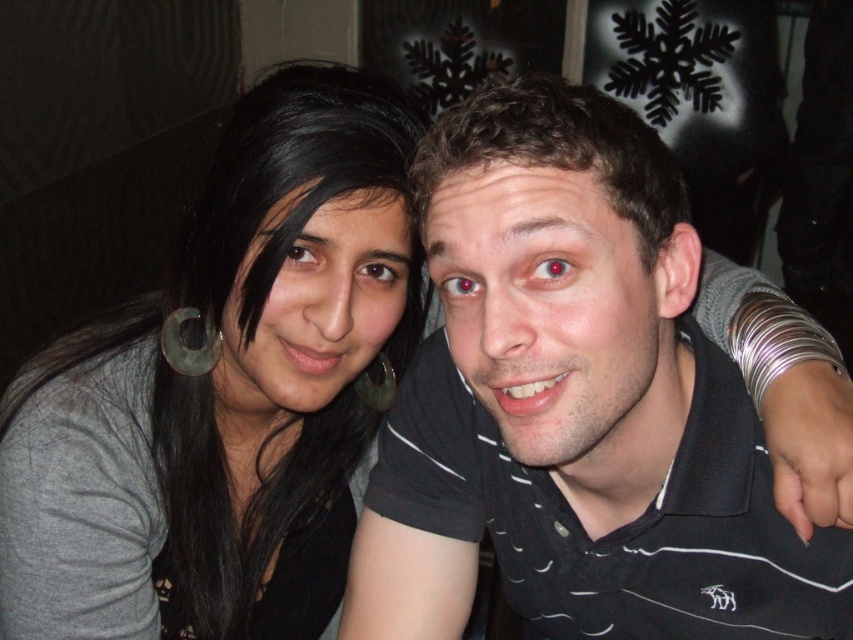
Question: Which object appears closest to the camera in this image?

Choices:
 (A) gray matte/black hair at upper left
 (B) black jersey at center

Answer: (B)

Question: Is black jersey at center wider than gray matte/black hair at upper left?

Choices:
 (A) yes
 (B) no

Answer: (A)

Question: In this image, where is black jersey at center located relative to gray matte/black hair at upper left?

Choices:
 (A) below
 (B) above

Answer: (A)

Question: Does black jersey at center appear under gray matte/black hair at upper left?

Choices:
 (A) yes
 (B) no

Answer: (A)

Question: Which point is farther to the camera?

Choices:
 (A) (260, 202)
 (B) (567, 392)

Answer: (A)